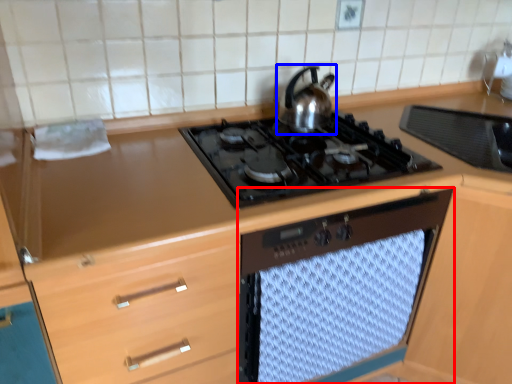
Question: Which point is further to the camera, oven (highlighted by a red box) or kitchen appliance (highlighted by a blue box)?

Choices:
 (A) oven
 (B) kitchen appliance

Answer: (B)